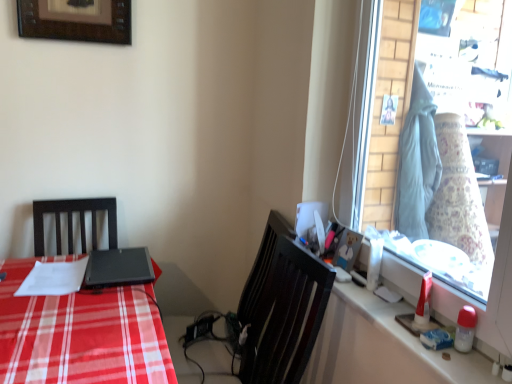
Find the location of a particular element. This screenshot has width=512, height=384. free location above white glossy counter top at right (from a real-world perspective) is located at coordinates (403, 308).